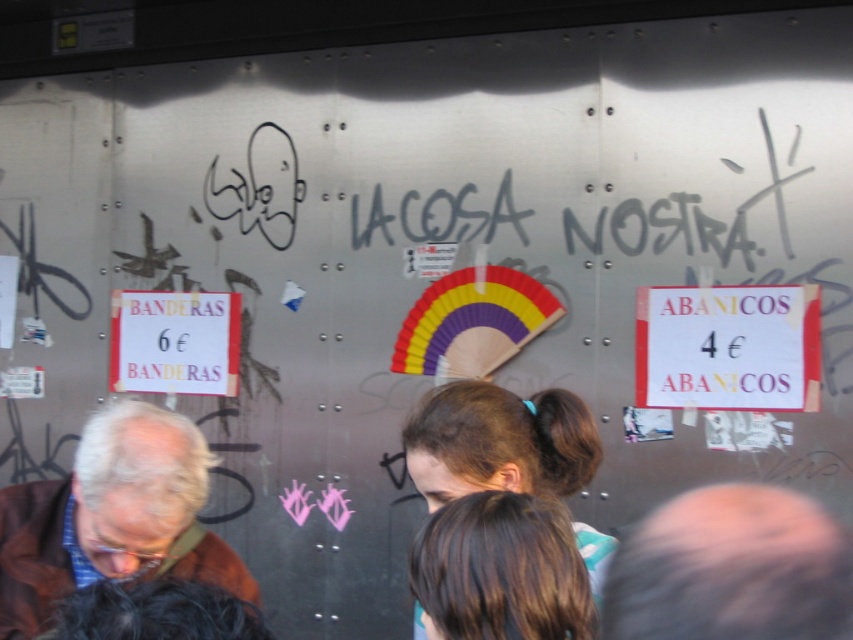
You are a tourist trying to read the white paper sign at right but notice the smooth skin head at lower right is blocking your view. Can you move around it to see the sign better?

The smooth skin head at lower right is closer to the viewer than the white paper sign at right, so moving around it towards the right side might allow you to see the sign better by positioning yourself behind the obstruction.

You are a delivery person who needs to hand over a package to someone. You see a brown leather jacket at lower left and a white paper sign at right. Which object is closer to you?

The brown leather jacket at lower left is closer to you because it is in front of the white paper sign at right.

You are a tourist in a city and you see the brown leather jacket at lower left and the white paper sign at right. Which object is positioned lower in the scene?

The brown leather jacket at lower left is positioned lower than the white paper sign at right.